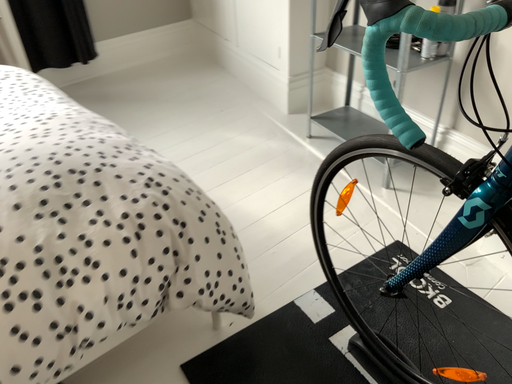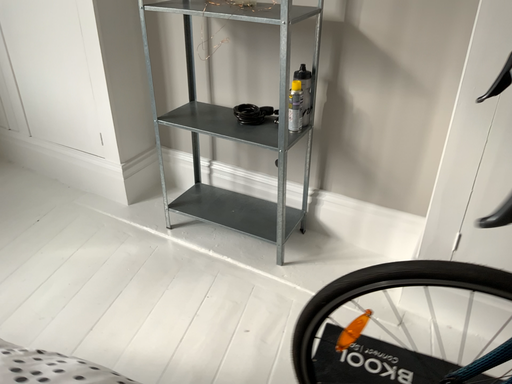
Question: How did the camera likely rotate when shooting the video?

Choices:
 (A) rotated upward
 (B) rotated downward

Answer: (A)